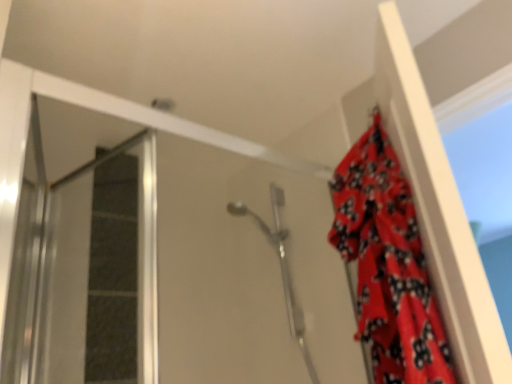
This screenshot has height=384, width=512. What do you see at coordinates (388, 264) in the screenshot? I see `red fabric curtain at upper right` at bounding box center [388, 264].

Where is `satin silver shower head at center`? This screenshot has height=384, width=512. satin silver shower head at center is located at coordinates (281, 267).

Image resolution: width=512 pixels, height=384 pixels. I want to click on transparent glass screen door at left, so click(44, 256).

What is the approximate height of transparent glass screen door at left?

transparent glass screen door at left is 26.56 inches in height.

I want to click on red fabric curtain at upper right, so click(388, 264).

Looking at this image, can you confirm if red fabric curtain at upper right is shorter than satin silver shower head at center?

Yes, red fabric curtain at upper right is shorter than satin silver shower head at center.

This screenshot has height=384, width=512. What are the coordinates of `curtain on the right side of satin silver shower head at center` in the screenshot? It's located at (388, 264).

From the image's perspective, is red fabric curtain at upper right beneath satin silver shower head at center?

No.

Considering the points (420, 325) and (296, 320), which point is behind, point (420, 325) or point (296, 320)?

The point (296, 320) is behind.

Is point (286, 273) positioned in front of point (394, 337)?

No, it is not.

Considering the relative sizes of satin silver shower head at center and red fabric curtain at upper right in the image provided, is satin silver shower head at center taller than red fabric curtain at upper right?

Yes.

Is the depth of satin silver shower head at center greater than that of red fabric curtain at upper right?

Yes, satin silver shower head at center is behind red fabric curtain at upper right.

Is red fabric curtain at upper right far away from transparent glass screen door at left?

That's not correct — red fabric curtain at upper right is a little close to transparent glass screen door at left.

Is red fabric curtain at upper right taller or shorter than transparent glass screen door at left?

In the image, red fabric curtain at upper right appears to be taller than transparent glass screen door at left.

Is point (365, 239) closer to viewer compared to point (28, 246)?

Yes, point (365, 239) is closer to viewer.

Is red fabric curtain at upper right not inside transparent glass screen door at left?

red fabric curtain at upper right lies outside transparent glass screen door at left's area.

From the image's perspective, is satin silver shower head at center on transparent glass screen door at left?

Incorrect, from the image's perspective, satin silver shower head at center is lower than transparent glass screen door at left.

Is transparent glass screen door at left located within satin silver shower head at center?

No, transparent glass screen door at left is not surrounded by satin silver shower head at center.

Is transparent glass screen door at left at the back of satin silver shower head at center?

No, transparent glass screen door at left is not at the back of satin silver shower head at center.

Who is more distant, satin silver shower head at center or transparent glass screen door at left?

satin silver shower head at center is more distant.

Consider the image. Is transparent glass screen door at left far away from red fabric curtain at upper right?

They are positioned close to each other.

Is red fabric curtain at upper right inside transparent glass screen door at left?

Actually, red fabric curtain at upper right is outside transparent glass screen door at left.

From a real-world perspective, who is located higher, transparent glass screen door at left or red fabric curtain at upper right?

transparent glass screen door at left, from a real-world perspective.

Considering the sizes of transparent glass screen door at left and satin silver shower head at center in the image, is transparent glass screen door at left wider or thinner than satin silver shower head at center?

Clearly, transparent glass screen door at left has more width compared to satin silver shower head at center.

Is there a large distance between transparent glass screen door at left and satin silver shower head at center?

No, transparent glass screen door at left is not far away from satin silver shower head at center.

How different are the orientations of transparent glass screen door at left and satin silver shower head at center in degrees?

The angle between the facing direction of transparent glass screen door at left and the facing direction of satin silver shower head at center is 102 degrees.

Is transparent glass screen door at left facing towards satin silver shower head at center?

No, transparent glass screen door at left is not aimed at satin silver shower head at center.

Find the location of `shower behind the red fabric curtain at upper right`. shower behind the red fabric curtain at upper right is located at coordinates (281, 267).

Identify the location of curtain to the right of satin silver shower head at center. (388, 264).

Which object lies further to the anchor point transparent glass screen door at left, satin silver shower head at center or red fabric curtain at upper right?

Based on the image, red fabric curtain at upper right appears to be further to transparent glass screen door at left.

From the image, which object appears to be nearer to red fabric curtain at upper right, satin silver shower head at center or transparent glass screen door at left?

satin silver shower head at center.

Considering their positions, is red fabric curtain at upper right positioned further to satin silver shower head at center than transparent glass screen door at left?

transparent glass screen door at left.

Based on their spatial positions, is red fabric curtain at upper right or satin silver shower head at center further from transparent glass screen door at left?

Based on the image, red fabric curtain at upper right appears to be further to transparent glass screen door at left.

Based on their spatial positions, is transparent glass screen door at left or red fabric curtain at upper right further from satin silver shower head at center?

transparent glass screen door at left lies further to satin silver shower head at center than the other object.

Looking at the image, which one is located closer to red fabric curtain at upper right, transparent glass screen door at left or satin silver shower head at center?

satin silver shower head at center is closer to red fabric curtain at upper right.

Where is `shower between transparent glass screen door at left and red fabric curtain at upper right`? shower between transparent glass screen door at left and red fabric curtain at upper right is located at coordinates (281, 267).